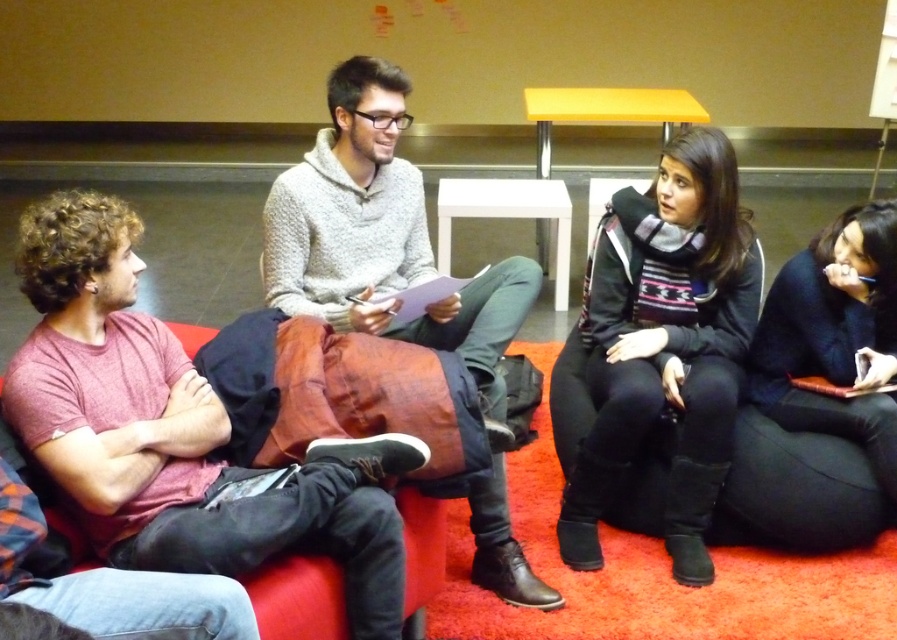
You are standing in the room and want to hand a document to both the matte red shirt at left and the gray knit sweater at center. Which person should you approach first to ensure you can reach them without moving past the other?

You should approach the matte red shirt at left first because it is closer to you than the gray knit sweater at center, so you can reach them without needing to move past the other person.

You are organizing a photo shoot and need to arrange two props based on their heights. The matte red shirt at left and the black fleece jacket at center are part of the scene. Which object should be placed on the lower shelf if the shelf below can only accommodate shorter items?

The matte red shirt at left should be placed on the lower shelf since it is shorter than the black fleece jacket at center, which cannot fit there due to its greater height.